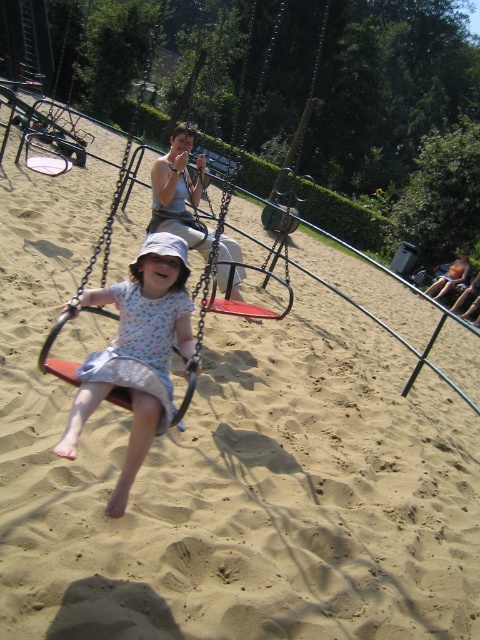
Between floral cotton dress at center and floral fabric dress at center, which one appears on the left side from the viewer's perspective?

From the viewer's perspective, floral fabric dress at center appears more on the left side.

Where is `floral cotton dress at center`? The height and width of the screenshot is (640, 480). floral cotton dress at center is located at coordinates (136, 353).